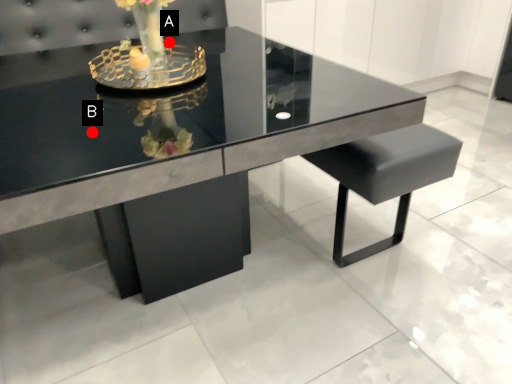
Question: Two points are circled on the image, labeled by A and B beside each circle. Which point is farther from the camera taking this photo?

Choices:
 (A) A is further
 (B) B is further

Answer: (B)